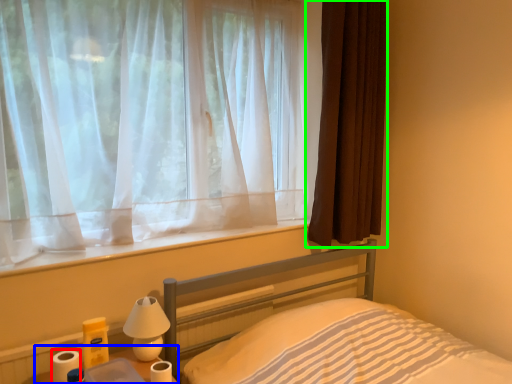
Question: Which is farther away from toilet paper (highlighted by a red box)? table (highlighted by a blue box) or curtain (highlighted by a green box)?

Choices:
 (A) table
 (B) curtain

Answer: (B)